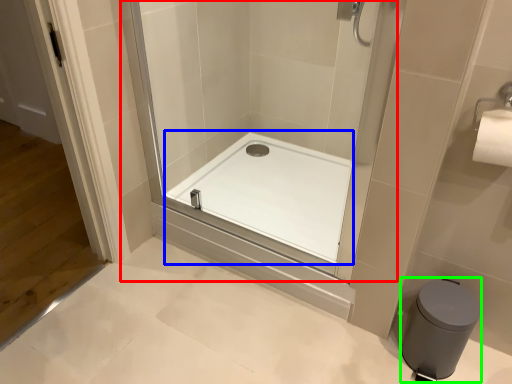
Question: Which is farther away from shower door (highlighted by a red box)? bath (highlighted by a blue box) or bidet (highlighted by a green box)?

Choices:
 (A) bath
 (B) bidet

Answer: (B)